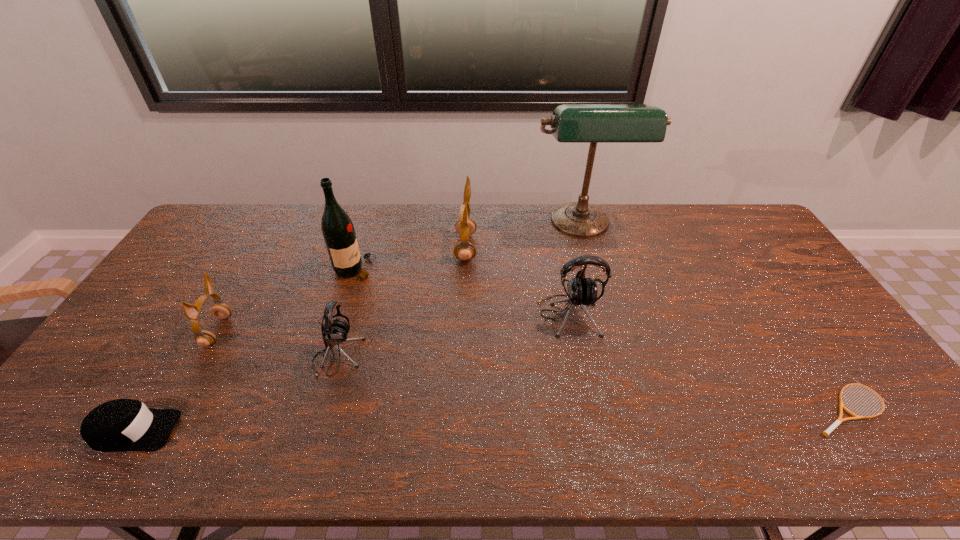
Identify the location of table lamp. (571, 123).

Identify the location of green table lamp. (571, 123).

Where is `green wine bottle`? This screenshot has width=960, height=540. green wine bottle is located at coordinates (338, 230).

Where is `the second tallest object`? This screenshot has width=960, height=540. the second tallest object is located at coordinates (338, 230).

The image size is (960, 540). Find the location of `the third earphone from left to right`. the third earphone from left to right is located at coordinates (465, 227).

The image size is (960, 540). What are the coordinates of `the right brown earphone` in the screenshot? It's located at [465, 227].

Image resolution: width=960 pixels, height=540 pixels. In order to click on the right black earphone in this screenshot , I will do `click(582, 291)`.

At what (x,y) coordinates should I click in order to perform the action: click on the rightmost earphone. Please return your answer as a coordinate pair (x, y). This screenshot has width=960, height=540. Looking at the image, I should click on (582, 291).

Identify the location of the nearer brown earphone. The width and height of the screenshot is (960, 540). (204, 338).

I want to click on the smaller brown earphone, so click(x=204, y=338).